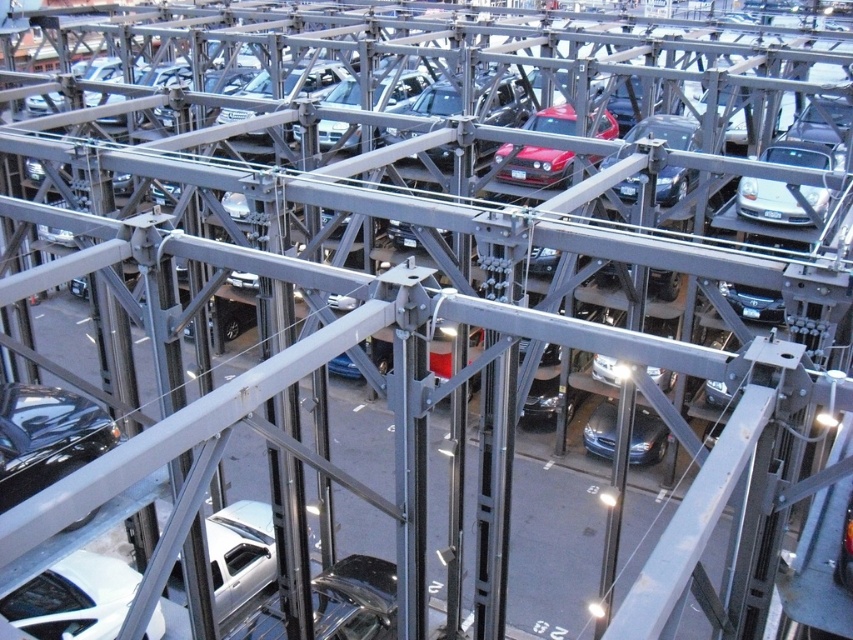
Question: Which object is closer to the camera taking this photo?

Choices:
 (A) silver metallic truck at center
 (B) shiny black car at center
 (C) silver metallic car at center right

Answer: (B)

Question: Observing the image, what is the correct spatial positioning of shiny black sedan at center in reference to metallic blue sedan at center?

Choices:
 (A) below
 (B) above

Answer: (B)

Question: Which of the following is the farthest from the observer?

Choices:
 (A) shiny black car at center
 (B) shiny black car at lower left
 (C) shiny red car at center

Answer: (C)

Question: Is shiny red car at center to the left of shiny black sedan at center from the viewer's perspective?

Choices:
 (A) yes
 (B) no

Answer: (A)

Question: Can you confirm if silver metallic truck at center is positioned above metallic blue sedan at center?

Choices:
 (A) no
 (B) yes

Answer: (A)

Question: Which point appears closest to the camera in this image?

Choices:
 (A) (738, 193)
 (B) (692, 134)
 (C) (364, 605)

Answer: (C)